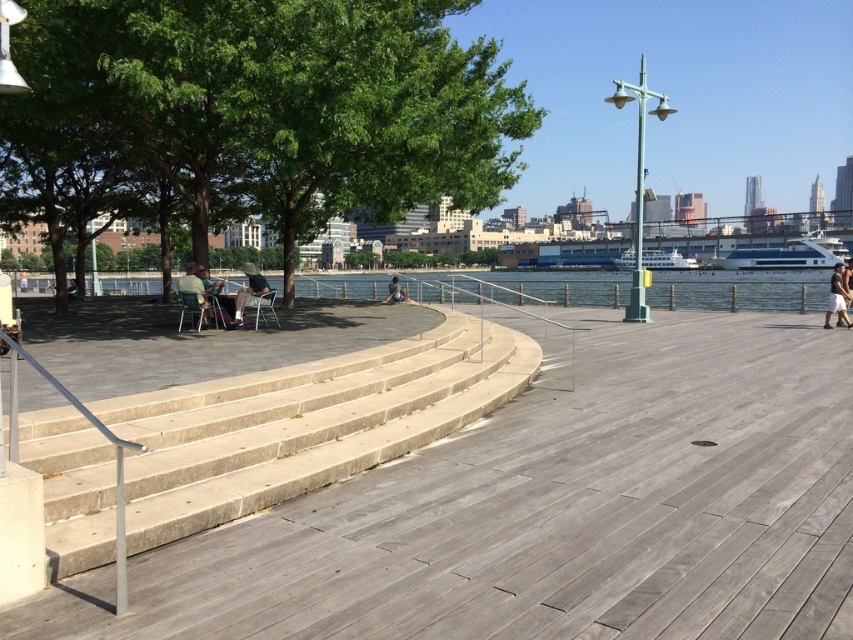
Question: Which object is positioned closest to the matte black umbrella at center?

Choices:
 (A) matte black chair at left
 (B) beige concrete stairs at left
 (C) dark gray cotton shorts at right

Answer: (A)

Question: Where is matte green chair at left located in relation to matte black umbrella at center in the image?

Choices:
 (A) left
 (B) right

Answer: (A)

Question: Does matte green chair at left lie behind matte black umbrella at center?

Choices:
 (A) no
 (B) yes

Answer: (A)

Question: Which of these objects is positioned closest to the dark gray cotton shorts at right?

Choices:
 (A) matte black umbrella at center
 (B) matte green chair at left
 (C) beige concrete stairs at left
 (D) matte black chair at left

Answer: (C)

Question: Does dark gray cotton shorts at right have a smaller size compared to matte black chair at left?

Choices:
 (A) no
 (B) yes

Answer: (A)

Question: Which object is farther from the camera taking this photo?

Choices:
 (A) matte black chair at left
 (B) beige concrete stairs at left
 (C) matte green chair at left
 (D) matte black umbrella at center

Answer: (D)